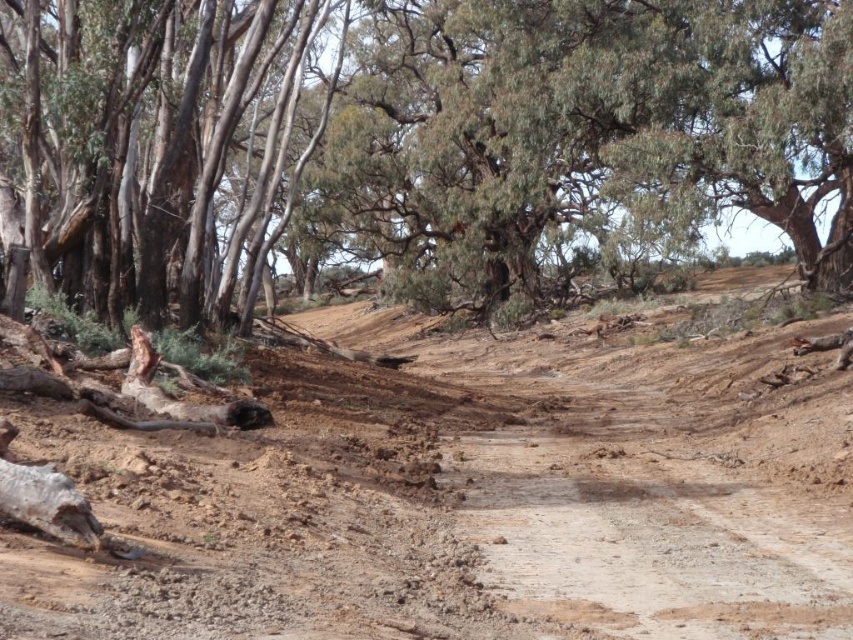
Question: Where is brown rough tree at upper left located in relation to dull brown dirt at center in the image?

Choices:
 (A) above
 (B) below

Answer: (A)

Question: Among these points, which one is nearest to the camera?

Choices:
 (A) tap(230, 76)
 (B) tap(737, 536)

Answer: (B)

Question: Is brown rough tree at upper left in front of dull brown dirt at center?

Choices:
 (A) yes
 (B) no

Answer: (B)

Question: Considering the real-world distances, which object is closest to the brown rough tree at upper left?

Choices:
 (A) dull brown dirt at center
 (B) smooth bark tree at upper left

Answer: (B)

Question: Can you confirm if dull brown dirt at center is smaller than smooth bark tree at upper left?

Choices:
 (A) no
 (B) yes

Answer: (B)

Question: Estimate the real-world distances between objects in this image. Which object is farther from the smooth bark tree at upper left?

Choices:
 (A) dull brown dirt at center
 (B) brown rough tree at upper left

Answer: (A)